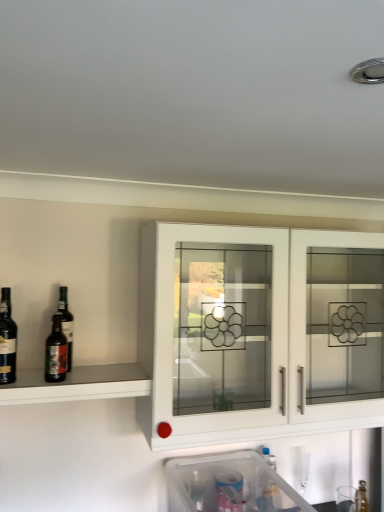
Where is `free space between dark brown glass bottle at left, which appears as the 2th wine when viewed from the right, and dark brown glass bottle at left, arranged as the first wine when viewed from the right`? The height and width of the screenshot is (512, 384). free space between dark brown glass bottle at left, which appears as the 2th wine when viewed from the right, and dark brown glass bottle at left, arranged as the first wine when viewed from the right is located at coordinates (29, 381).